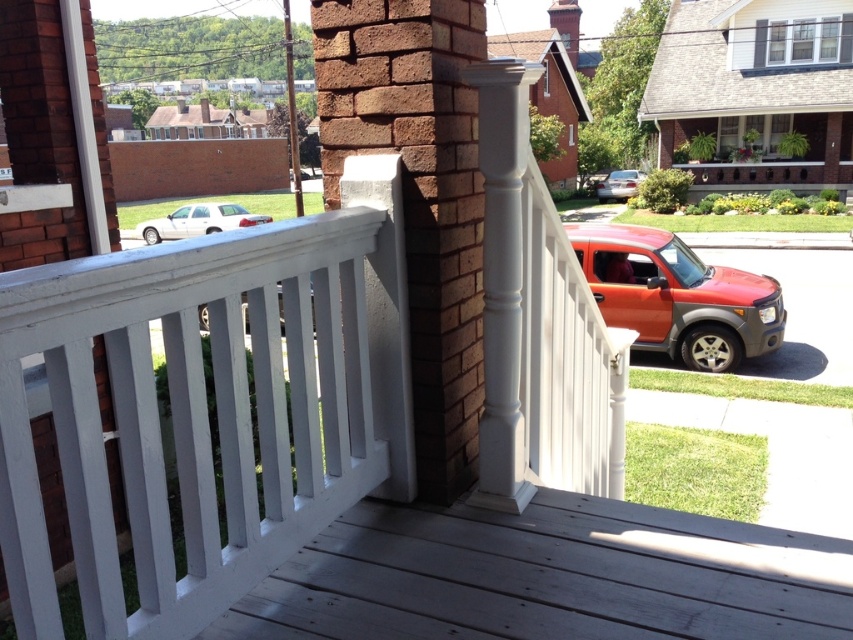
You are standing on the porch and want to take a photo of both the white wood deck at center and the metallic silver car at center. Which object should you focus on first to ensure it appears sharp in the photo?

You should focus on the white wood deck at center first because it is closer to you than the metallic silver car at center, so focusing on it will keep both objects sharp as the car is further away.